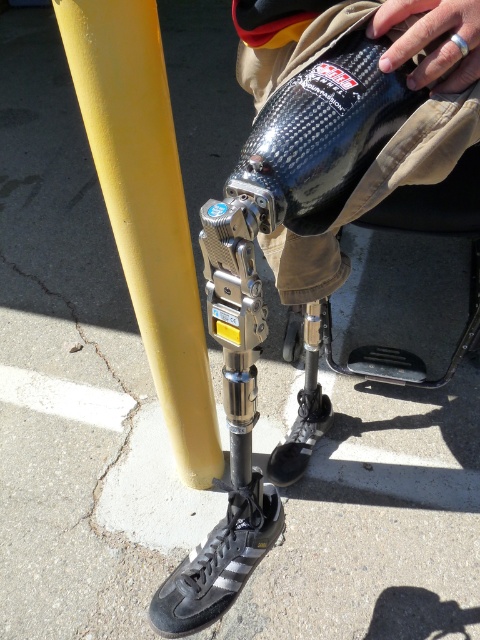
You are standing 3 feet away from the prosthetic leg shown in the image. You want to place a small sticker exactly at the point labeled as point (219, 472). Can you reach the point without moving closer than your current position?

The distance of point (219, 472) from viewer is 5.00 feet. Since you are currently 3 feet away, you are closer than the required distance to reach the point. Therefore, you need to move back to 5 feet away to place the sticker accurately.

You are an athlete preparing for a marathon and need to choose between the yellow matte pole at left and the carbon fiber bottle at center for your hydration needs. Based on their sizes, which one can hold more liquid?

The carbon fiber bottle at center is thicker than the yellow matte pole at left, so it can hold more liquid.

You are a physical therapist examining the prosthetic leg setup. You notice the yellow matte pole at left and the carbon fiber bottle at center. Which object is supporting the other?

The yellow matte pole at left is positioned under the carbon fiber bottle at center, so the pole is supporting the bottle.